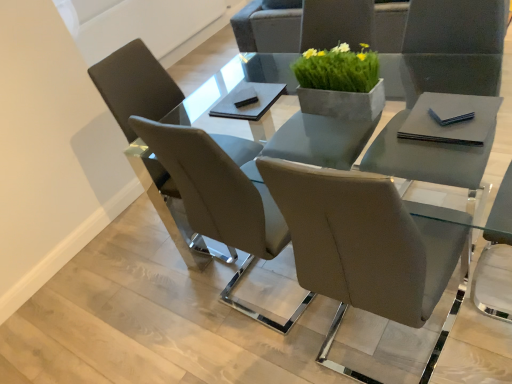
Question: Would you say green concrete planter at center is a long distance from clear glass table at center?

Choices:
 (A) no
 (B) yes

Answer: (B)

Question: Considering the relative sizes of green concrete planter at center and clear glass table at center in the image provided, is green concrete planter at center taller than clear glass table at center?

Choices:
 (A) yes
 (B) no

Answer: (B)

Question: Can you confirm if green concrete planter at center is positioned to the right of clear glass table at center?

Choices:
 (A) no
 (B) yes

Answer: (A)

Question: Is green concrete planter at center thinner than clear glass table at center?

Choices:
 (A) no
 (B) yes

Answer: (B)

Question: From the image's perspective, does green concrete planter at center appear higher than clear glass table at center?

Choices:
 (A) yes
 (B) no

Answer: (A)

Question: From a real-world perspective, is clear glass table at center positioned above or below matte gray chair at center, acting as the first chair starting from the front?

Choices:
 (A) below
 (B) above

Answer: (A)

Question: Considering their positions, is clear glass table at center located in front of or behind matte gray chair at center, acting as the first chair starting from the front?

Choices:
 (A) behind
 (B) front

Answer: (B)

Question: Is point (154, 163) closer or farther from the camera than point (199, 162)?

Choices:
 (A) closer
 (B) farther

Answer: (B)

Question: From the image's perspective, is clear glass table at center above or below matte gray chair at center, the 2th chair positioned from the back?

Choices:
 (A) below
 (B) above

Answer: (B)

Question: From a real-world perspective, is matte gray chair at center, the 2th chair positioned from the back, positioned above or below matte gray chair at left, the 2th chair viewed from the front?

Choices:
 (A) below
 (B) above

Answer: (B)

Question: Is matte gray chair at center, the 2th chair positioned from the back, wider or thinner than matte gray chair at left, which ranks as the 1th chair in back-to-front order?

Choices:
 (A) thin
 (B) wide

Answer: (A)

Question: From their relative heights in the image, would you say matte gray chair at center, acting as the first chair starting from the front, is taller or shorter than matte gray chair at left, the 2th chair viewed from the front?

Choices:
 (A) tall
 (B) short

Answer: (A)

Question: In the image, is matte gray chair at center, acting as the first chair starting from the front, on the left side or the right side of matte gray chair at left, the 2th chair viewed from the front?

Choices:
 (A) right
 (B) left

Answer: (A)

Question: From the image's perspective, is green concrete planter at center above or below matte gray chair at center, acting as the first chair starting from the front?

Choices:
 (A) above
 (B) below

Answer: (A)

Question: Considering the positions of green concrete planter at center and matte gray chair at center, the 2th chair positioned from the back, in the image, is green concrete planter at center taller or shorter than matte gray chair at center, the 2th chair positioned from the back,?

Choices:
 (A) tall
 (B) short

Answer: (B)